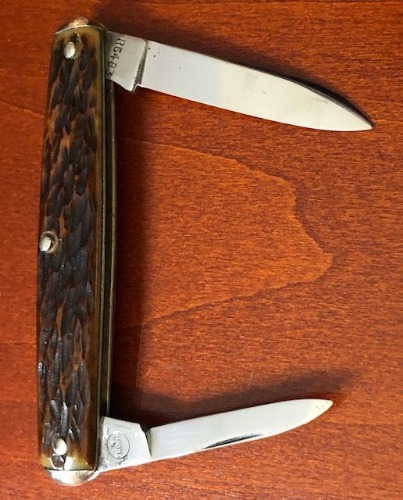
Locate an element on the screen. The image size is (403, 500). wooden surface is located at coordinates (260, 237).